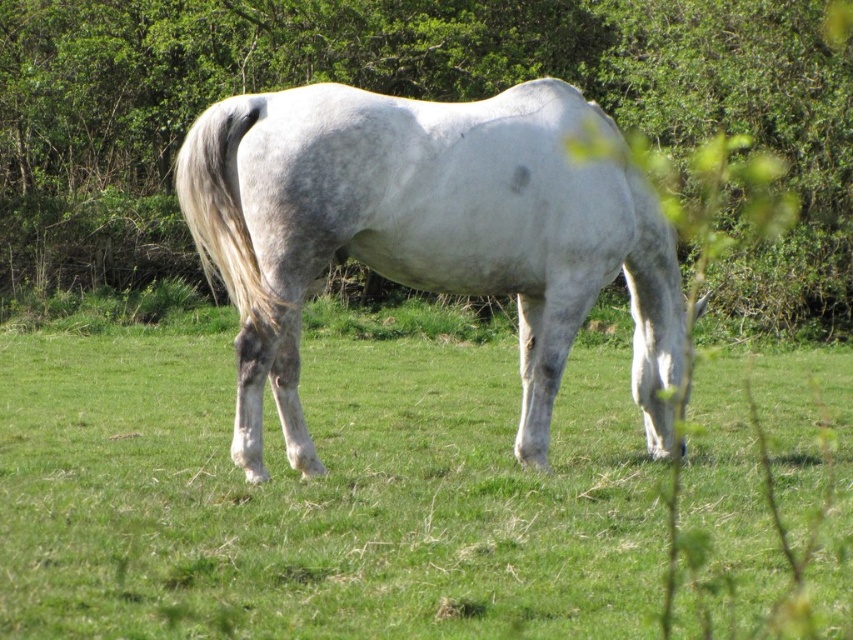
You are a photographer wanting to capture the white matte horse at center and the green leafy tree at center in a single frame. Given their sizes, which one would you need to position closer to the camera to ensure both appear balanced in size in your photo?

The green leafy tree at center is larger in size than the white matte horse at center. To balance their sizes in the photo, you should position the white matte horse at center closer to the camera while keeping the green leafy tree at center farther away.

You are standing at the point where the horse is grazing. Looking at the green grass at center located at point (317, 496), can you tell me the direction of the grass relative to the horse?

The green grass at center is located at point (317, 496), which is directly in front of the horse since the horse is facing forward while grazing.

You are standing in the field and want to walk from the green leafy tree at center to the green grass at center. Which direction should you face?

The green grass at center is to the right of the green leafy tree at center, so you should face to the right to walk from the green leafy tree at center to the green grass at center.